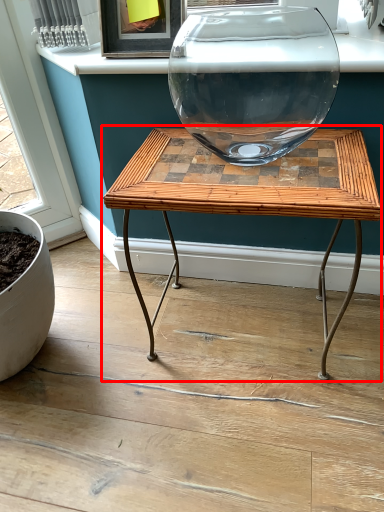
Question: Observing the image, what is the correct spatial positioning of table (annotated by the red box) in reference to window sill?

Choices:
 (A) right
 (B) left

Answer: (A)